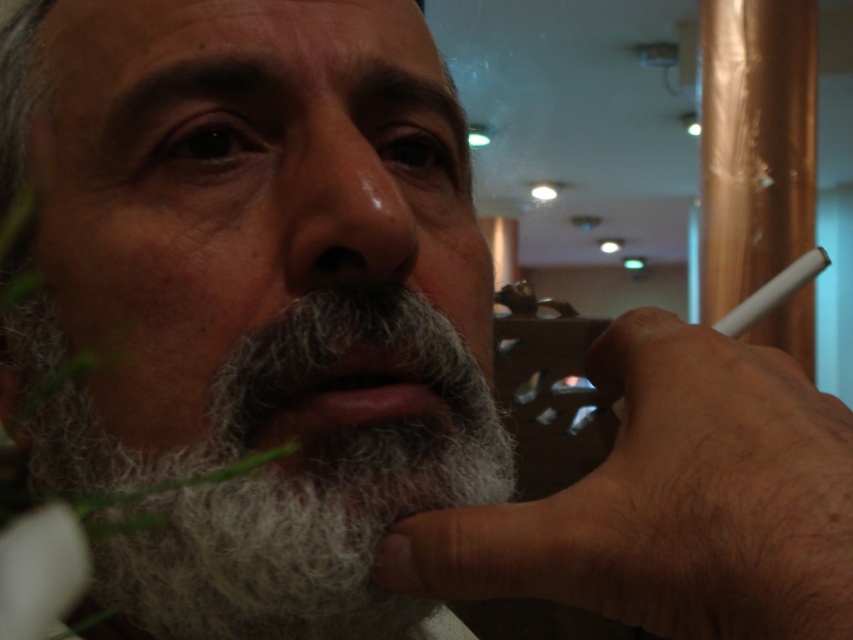
You are a photographer trying to capture a close shot of the person in the image. You notice two points in the scene at coordinates point (363, 316) and point (408, 128). Which point should you focus on to ensure the subject is in sharp focus?

Point (363, 316) should be focused on because it is closer to the camera than point (408, 128), ensuring the subject is in sharp focus.

You are a photographer adjusting your camera to focus on the facial features of the person in the image. You need to ensure both the gray fuzzy beard at lower left and the dry matte nose at center are in sharp focus. Since your camera can only focus on one point at a time, which object should you choose to focus on so that both are in focus? Explain your reasoning based on their positions.

You should focus on the dry matte nose at center because the gray fuzzy beard at lower left is to the left of it. By focusing on the nose, which is centrally located, the depth of field will likely include both the beard and the nose in sharp focus since they are aligned horizontally.